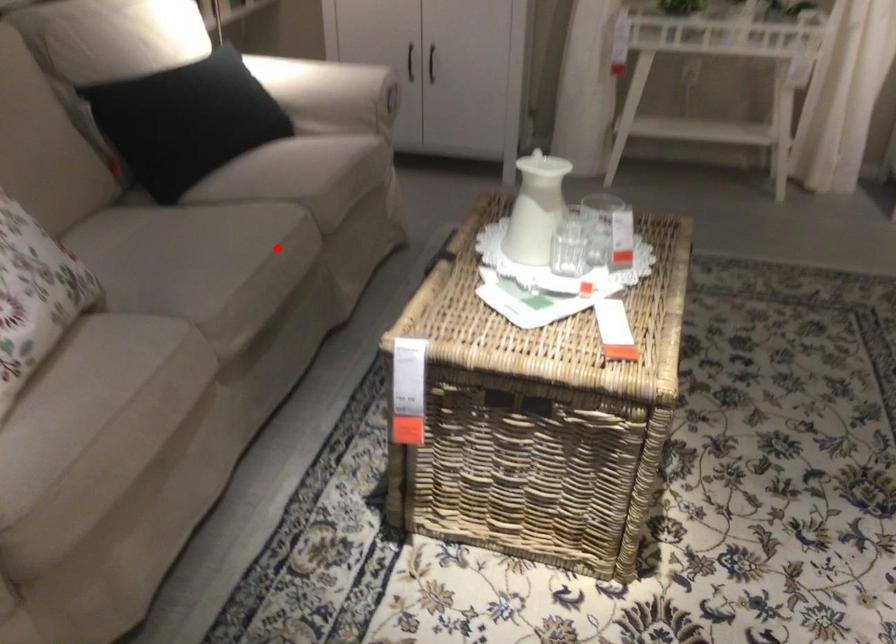
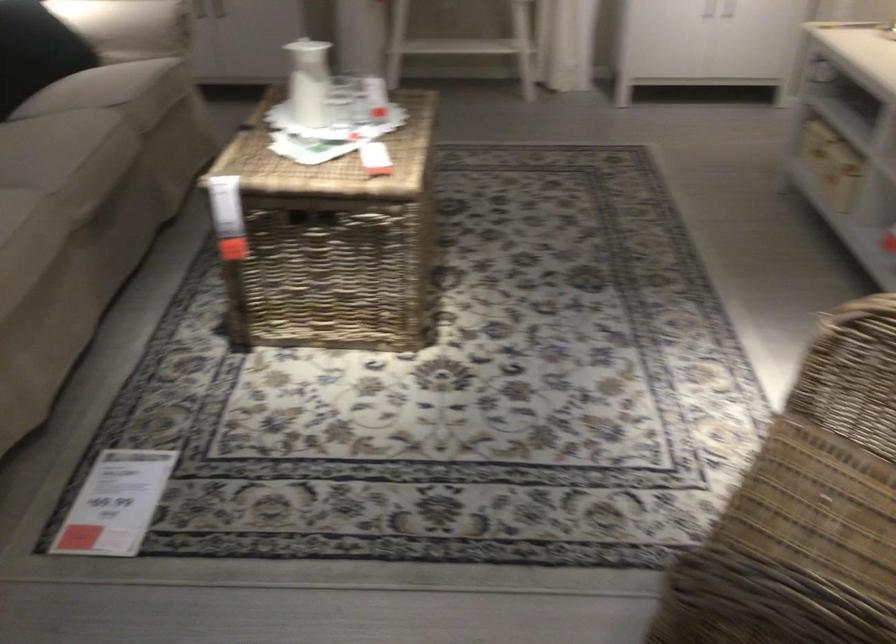
The point at the highlighted location is marked in the first image. Where is the corresponding point in the second image?

(109, 140)